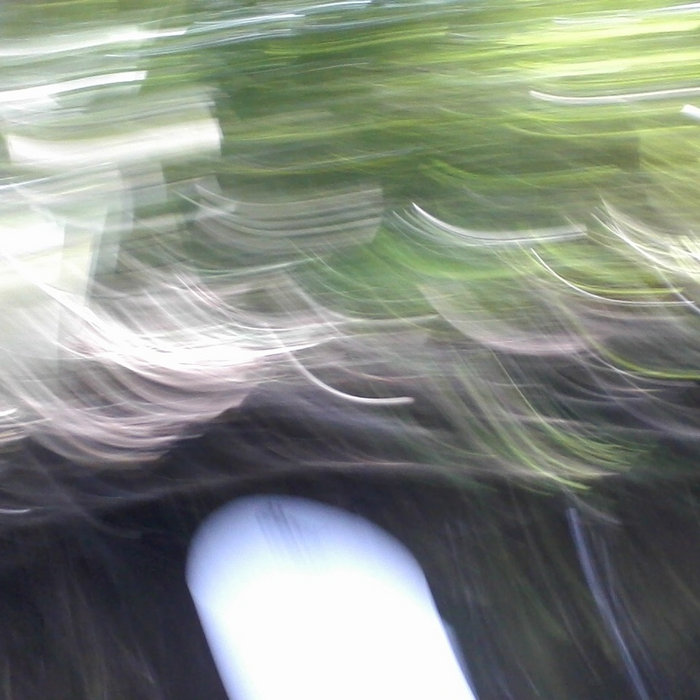
Image resolution: width=700 pixels, height=700 pixels. Identify the location of light. (284, 594).